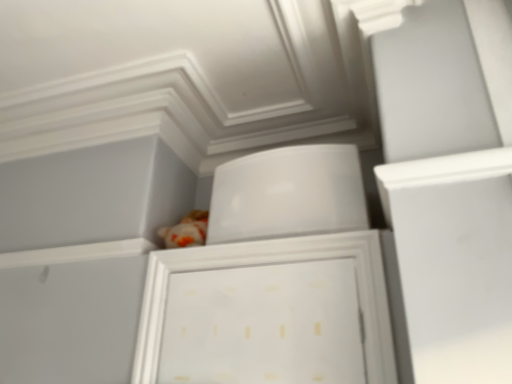
What do you see at coordinates (288, 194) in the screenshot? I see `white glossy refrigerator at upper center` at bounding box center [288, 194].

Identify the location of white glossy refrigerator at upper center. The height and width of the screenshot is (384, 512). (288, 194).

Locate an element on the screen. white glossy refrigerator at upper center is located at coordinates (288, 194).